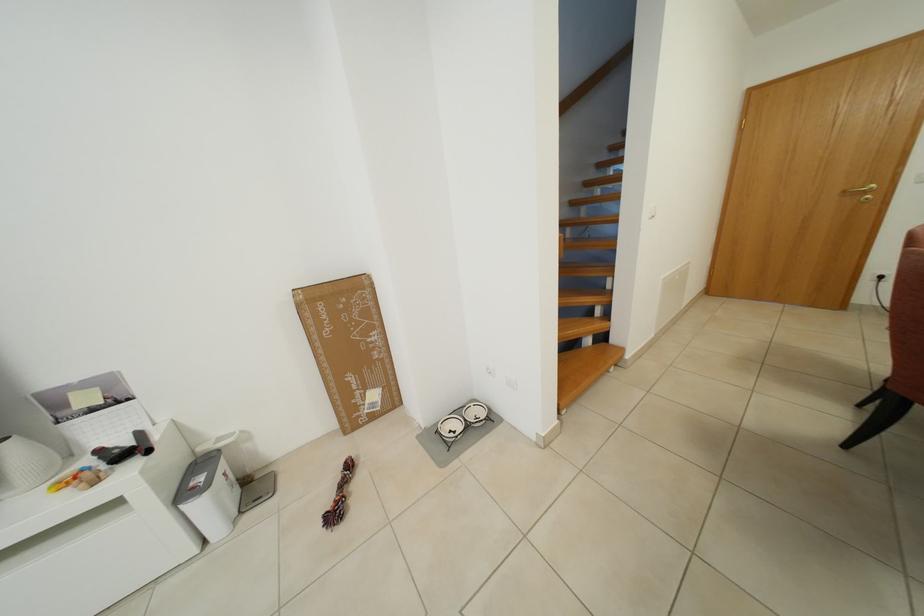
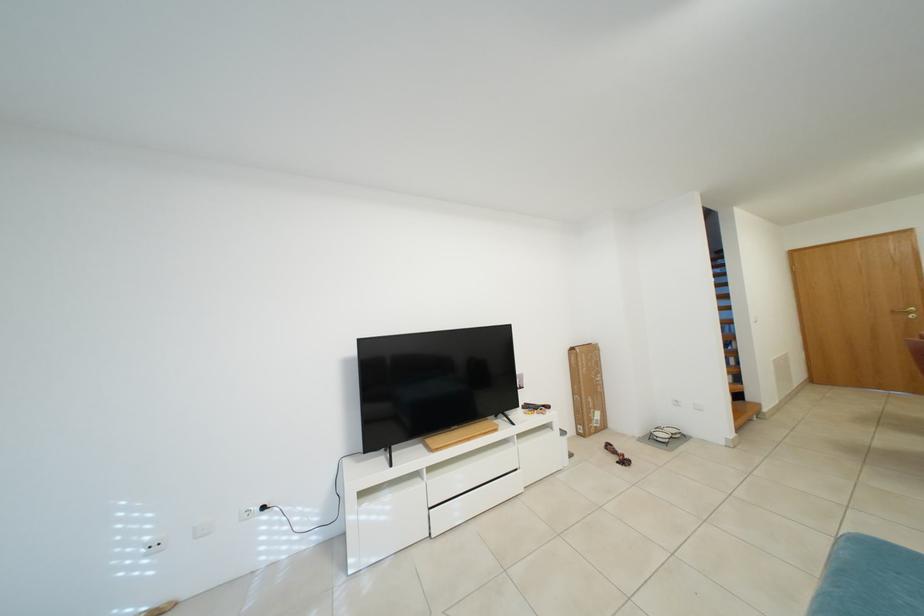
The point at [873,197] is marked in the first image. Where is the corresponding point in the second image?

(918, 317)